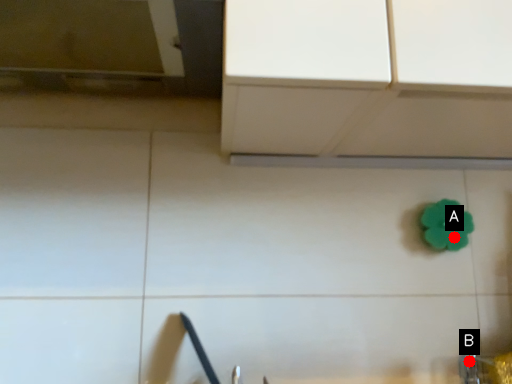
Question: Two points are circled on the image, labeled by A and B beside each circle. Which point appears closest to the camera in this image?

Choices:
 (A) A is closer
 (B) B is closer

Answer: (B)